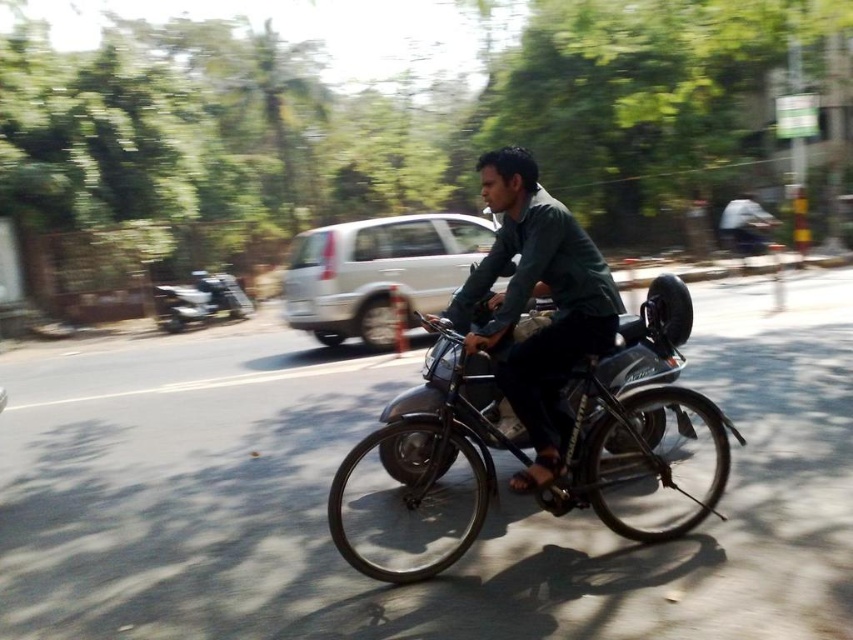
Question: Does green matte shirt at center lie behind metallic silver scooter at left?

Choices:
 (A) yes
 (B) no

Answer: (B)

Question: Which object is closer to the camera taking this photo?

Choices:
 (A) green matte shirt at center
 (B) metallic silver motorcycle at center

Answer: (B)

Question: Estimate the real-world distances between objects in this image. Which object is closer to the metallic silver motorcycle at center?

Choices:
 (A) green matte shirt at center
 (B) metallic silver scooter at left

Answer: (A)

Question: Which of these objects is positioned closest to the metallic silver motorcycle at center?

Choices:
 (A) metallic silver scooter at left
 (B) green matte shirt at center

Answer: (B)

Question: Can you confirm if green matte shirt at center is positioned below metallic silver scooter at left?

Choices:
 (A) yes
 (B) no

Answer: (A)

Question: Does metallic silver motorcycle at center appear on the right side of metallic silver scooter at left?

Choices:
 (A) no
 (B) yes

Answer: (B)